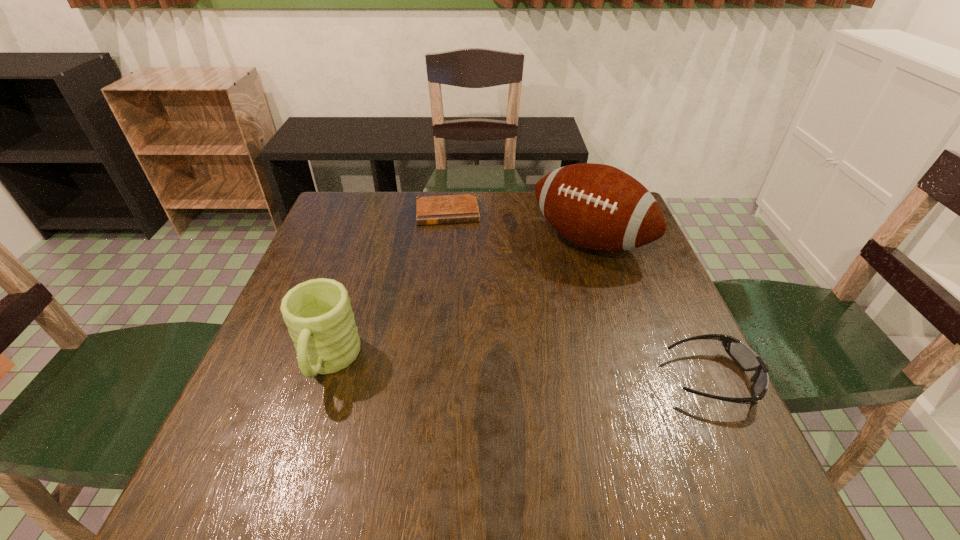
This screenshot has width=960, height=540. I want to click on vacant space on the desktop that is between the mug and the sunglasses and is positioned on the spine side of the third object from right to left, so click(x=462, y=368).

In order to click on free space on the desktop that is between the mug and the sunglasses and is positioned on the laces of the tallest object in this screenshot , I will do `click(466, 368)`.